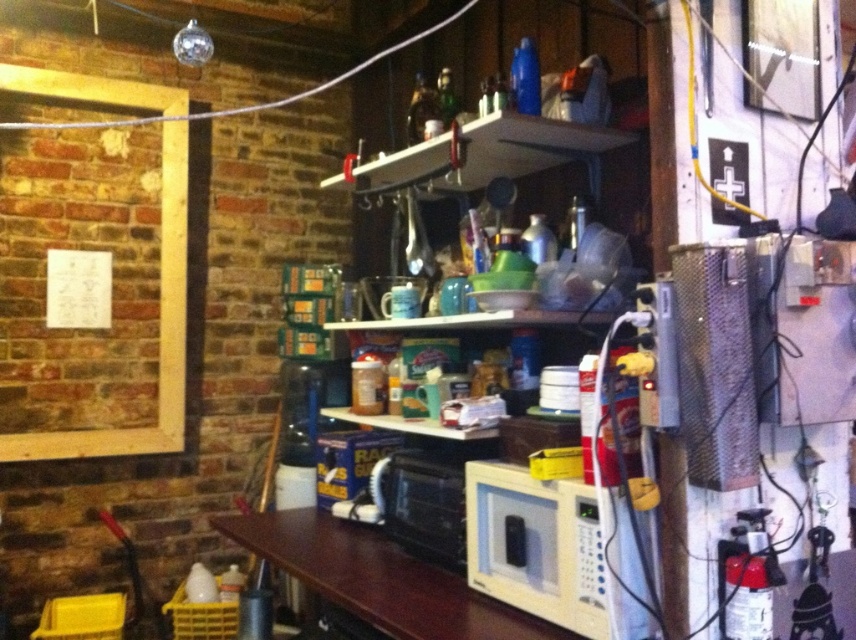
Does white matte microwave at center have a greater height compared to white plastic microwave at center?

Yes.

In order to click on white matte microwave at center in this screenshot , I will do `click(536, 545)`.

Can you confirm if white matte microwave at center is wider than brown wood table at center?

No.

Locate an element on the screen. white matte microwave at center is located at coordinates (536, 545).

The height and width of the screenshot is (640, 856). What are the coordinates of `white matte microwave at center` in the screenshot? It's located at (536, 545).

Between brown wood table at center and white plastic microwave at center, which one appears on the right side from the viewer's perspective?

white plastic microwave at center is more to the right.

Is brown wood table at center to the right of white plastic microwave at center from the viewer's perspective?

No, brown wood table at center is not to the right of white plastic microwave at center.

The height and width of the screenshot is (640, 856). What do you see at coordinates (377, 579) in the screenshot?
I see `brown wood table at center` at bounding box center [377, 579].

The image size is (856, 640). I want to click on brown wood table at center, so click(x=377, y=579).